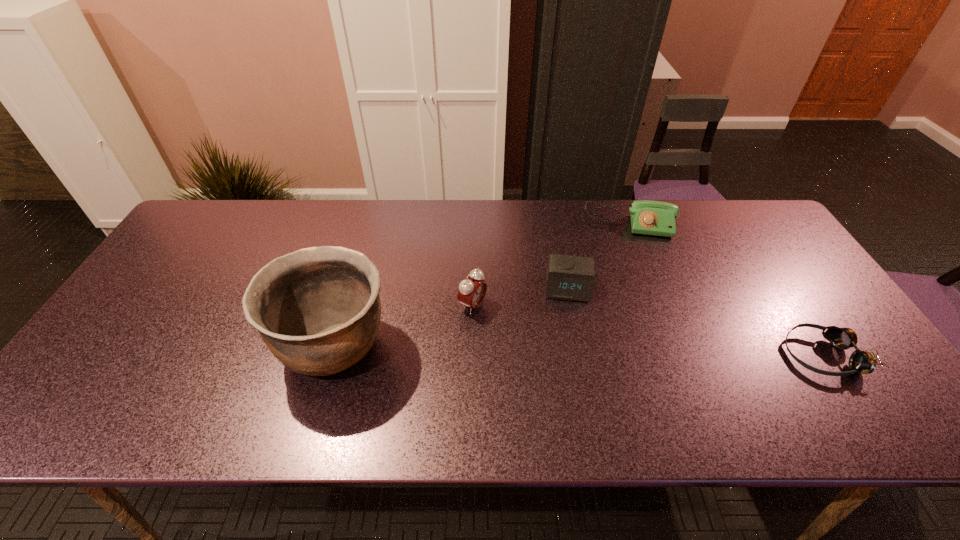
Where is `vacant space located 0.170m on the front-facing side of the shorter alarm clock`? vacant space located 0.170m on the front-facing side of the shorter alarm clock is located at coordinates (567, 355).

Where is `vacant space located 0.270m on the front-facing side of the shorter alarm clock`? This screenshot has height=540, width=960. vacant space located 0.270m on the front-facing side of the shorter alarm clock is located at coordinates (567, 391).

Where is `free region located 0.260m on the front-facing side of the shorter alarm clock`? Image resolution: width=960 pixels, height=540 pixels. free region located 0.260m on the front-facing side of the shorter alarm clock is located at coordinates (567, 387).

Find the location of a particular element. The height and width of the screenshot is (540, 960). object present at the far edge is located at coordinates (648, 217).

You are a GUI agent. You are given a task and a screenshot of the screen. Output one action in this format:
    pyautogui.click(x=<x>, y=<y>)
    Task: Click on the pottery that is at the near edge
    
    Given the screenshot: What is the action you would take?
    pyautogui.click(x=317, y=309)

Locate an element on the screen. goggles located at the near edge is located at coordinates (864, 362).

The image size is (960, 540). What are the coordinates of `object at the right edge` in the screenshot? It's located at (864, 362).

Find the location of a particular element. object that is at the near right corner is located at coordinates coord(864,362).

Where is `vacant space at the far edge of the desktop`? This screenshot has width=960, height=540. vacant space at the far edge of the desktop is located at coordinates (609, 236).

Find the location of a particular element. This screenshot has height=540, width=960. vacant space at the near edge of the desktop is located at coordinates (451, 366).